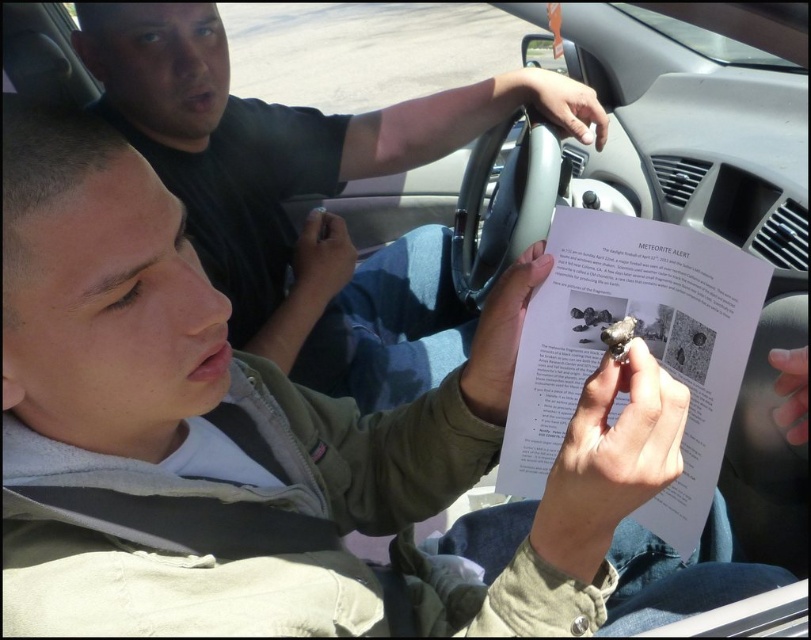
Consider the image. You are a passenger in a car and see the matte black paper at center and the shiny metallic rock at center. Which object is closer to you?

The matte black paper at center is closer to you because it is further to the viewer than the shiny metallic rock at center.

You are a passenger in a car and see the matte black paper at center and the shiny metallic rock at center. Which object is located higher up?

The matte black paper at center is above the shiny metallic rock at center, so the matte black paper at center is located higher up.

You are a passenger in a car and see the matte black paper at center. If you want to touch it, which direction should you move your hand relative to your current position?

The matte black paper at center is located at point 0.303 in the x coordinate and 0.377 in the y coordinate. Since the paper is at the center of the image, you should move your hand towards the center of the car to touch it.